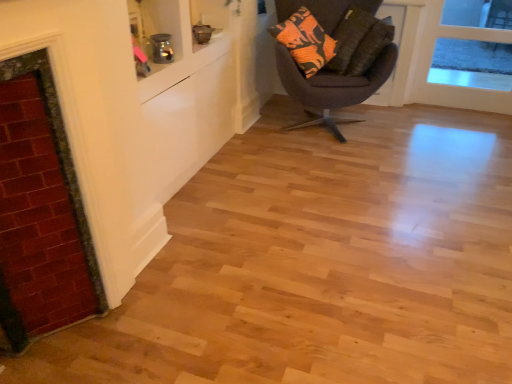
Describe the element at coordinates (349, 37) in the screenshot. I see `orange patterned pillow at upper right, the first pillow when ordered from back to front` at that location.

Describe the element at coordinates (332, 87) in the screenshot. The height and width of the screenshot is (384, 512). I see `dark brown fabric chair at center` at that location.

Identify the location of transparent glass door at upper right. The image size is (512, 384). (455, 86).

From the image's perspective, which is below, orange patterned pillow at upper right, the first pillow when ordered from back to front, or transparent glass door at upper right?

transparent glass door at upper right, from the image's perspective.

In terms of height, does orange patterned pillow at upper right, the first pillow when ordered from back to front, look taller or shorter compared to transparent glass door at upper right?

Clearly, orange patterned pillow at upper right, the first pillow when ordered from back to front, is shorter compared to transparent glass door at upper right.

At what (x,y) coordinates should I click in order to perform the action: click on door below the orange patterned pillow at upper right, which is counted as the second pillow, starting from the front (from a real-world perspective). Please return your answer as a coordinate pair (x, y). Image resolution: width=512 pixels, height=384 pixels. Looking at the image, I should click on (455, 86).

Which of these two, orange patterned pillow at upper right, which is counted as the second pillow, starting from the front, or transparent glass door at upper right, is wider?

orange patterned pillow at upper right, which is counted as the second pillow, starting from the front.

Is red brick fireplace at left facing away from dark brown fabric chair at center?

red brick fireplace at left does not have its back to dark brown fabric chair at center.

Between red brick fireplace at left and dark brown fabric chair at center, which one has more height?

With more height is red brick fireplace at left.

Is red brick fireplace at left at the right side of dark brown fabric chair at center?

No, red brick fireplace at left is not to the right of dark brown fabric chair at center.

From a real-world perspective, between transparent glass door at upper right and orange printed fabric pillow at upper right, marked as the 1th pillow in a front-to-back arrangement, who is vertically lower?

transparent glass door at upper right is physically lower.

Is transparent glass door at upper right spatially inside orange printed fabric pillow at upper right, acting as the second pillow starting from the back, or outside of it?

transparent glass door at upper right is not inside orange printed fabric pillow at upper right, acting as the second pillow starting from the back, it's outside.

How many degrees apart are the facing directions of transparent glass door at upper right and orange printed fabric pillow at upper right, acting as the second pillow starting from the back?

48 degrees.

Considering the relative sizes of transparent glass door at upper right and orange printed fabric pillow at upper right, marked as the 1th pillow in a front-to-back arrangement, in the image provided, is transparent glass door at upper right smaller than orange printed fabric pillow at upper right, marked as the 1th pillow in a front-to-back arrangement,?

Incorrect, transparent glass door at upper right is not smaller in size than orange printed fabric pillow at upper right, marked as the 1th pillow in a front-to-back arrangement.

From the image's perspective, is orange patterned pillow at upper right, which is counted as the second pillow, starting from the front, positioned above or below red brick fireplace at left?

Clearly, from the image's perspective, orange patterned pillow at upper right, which is counted as the second pillow, starting from the front, is above red brick fireplace at left.

Between orange patterned pillow at upper right, the first pillow when ordered from back to front, and red brick fireplace at left, which one has larger size?

orange patterned pillow at upper right, the first pillow when ordered from back to front, is bigger.

Is orange patterned pillow at upper right, which is counted as the second pillow, starting from the front, to the left of red brick fireplace at left from the viewer's perspective?

Incorrect, orange patterned pillow at upper right, which is counted as the second pillow, starting from the front, is not on the left side of red brick fireplace at left.

The height and width of the screenshot is (384, 512). I want to click on chair that appears behind the red brick fireplace at left, so 332,87.

Considering the relative positions of dark brown fabric chair at center and red brick fireplace at left in the image provided, is dark brown fabric chair at center behind red brick fireplace at left?

Yes, the depth of dark brown fabric chair at center is greater than that of red brick fireplace at left.

Which is more distant, (281, 59) or (76, 315)?

Positioned behind is point (281, 59).

Can you confirm if dark brown fabric chair at center is taller than red brick fireplace at left?

No, dark brown fabric chair at center is not taller than red brick fireplace at left.

Between point (362, 57) and point (417, 53), which one is positioned in front?

The point (362, 57) is closer.

Who is smaller, orange printed fabric pillow at upper right, acting as the second pillow starting from the back, or transparent glass door at upper right?

Smaller between the two is orange printed fabric pillow at upper right, acting as the second pillow starting from the back.

Looking at their sizes, would you say orange printed fabric pillow at upper right, acting as the second pillow starting from the back, is wider or thinner than transparent glass door at upper right?

orange printed fabric pillow at upper right, acting as the second pillow starting from the back, is wider than transparent glass door at upper right.

From a real-world perspective, is orange printed fabric pillow at upper right, marked as the 1th pillow in a front-to-back arrangement, over transparent glass door at upper right?

Correct, in the physical world, orange printed fabric pillow at upper right, marked as the 1th pillow in a front-to-back arrangement, is higher than transparent glass door at upper right.

Considering the sizes of objects orange printed fabric pillow at upper right, acting as the second pillow starting from the back, and dark brown fabric chair at center in the image provided, who is thinner, orange printed fabric pillow at upper right, acting as the second pillow starting from the back, or dark brown fabric chair at center?

orange printed fabric pillow at upper right, acting as the second pillow starting from the back.

How many degrees apart are the facing directions of orange printed fabric pillow at upper right, marked as the 1th pillow in a front-to-back arrangement, and dark brown fabric chair at center?

The angle between the facing direction of orange printed fabric pillow at upper right, marked as the 1th pillow in a front-to-back arrangement, and the facing direction of dark brown fabric chair at center is 31.7 degrees.

From a real-world perspective, which is physically above, orange printed fabric pillow at upper right, acting as the second pillow starting from the back, or dark brown fabric chair at center?

In real-world perspective, orange printed fabric pillow at upper right, acting as the second pillow starting from the back, is above.

Is orange printed fabric pillow at upper right, acting as the second pillow starting from the back, smaller than dark brown fabric chair at center?

Indeed, orange printed fabric pillow at upper right, acting as the second pillow starting from the back, has a smaller size compared to dark brown fabric chair at center.

From the transparent glass door at upper right, count 1st pillows forward and point to it. Please provide its 2D coordinates.

[(349, 37)]

The width and height of the screenshot is (512, 384). I want to click on chair on the right side of red brick fireplace at left, so click(332, 87).

Which object lies further to the anchor point transparent glass door at upper right, red brick fireplace at left or orange patterned pillow at upper right, which is counted as the second pillow, starting from the front?

The object further to transparent glass door at upper right is red brick fireplace at left.

Which object lies nearer to the anchor point red brick fireplace at left, orange printed fabric pillow at upper right, acting as the second pillow starting from the back, or dark brown fabric chair at center?

dark brown fabric chair at center is positioned closer to the anchor red brick fireplace at left.

Estimate the real-world distances between objects in this image. Which object is further from dark brown fabric chair at center, orange patterned pillow at upper right, which is counted as the second pillow, starting from the front, or transparent glass door at upper right?

transparent glass door at upper right is further to dark brown fabric chair at center.

When comparing their distances from red brick fireplace at left, does orange patterned pillow at upper right, the first pillow when ordered from back to front, or dark brown fabric chair at center seem further?

The object further to red brick fireplace at left is orange patterned pillow at upper right, the first pillow when ordered from back to front.

Estimate the real-world distances between objects in this image. Which object is further from orange printed fabric pillow at upper right, marked as the 1th pillow in a front-to-back arrangement, orange patterned pillow at upper right, which is counted as the second pillow, starting from the front, or dark brown fabric chair at center?

dark brown fabric chair at center is positioned further to the anchor orange printed fabric pillow at upper right, marked as the 1th pillow in a front-to-back arrangement.

When comparing their distances from orange patterned pillow at upper right, the first pillow when ordered from back to front, does orange printed fabric pillow at upper right, acting as the second pillow starting from the back, or red brick fireplace at left seem further?

red brick fireplace at left is positioned further to the anchor orange patterned pillow at upper right, the first pillow when ordered from back to front.

Based on the photo, estimate the real-world distances between objects in this image. Which object is closer to orange patterned pillow at upper right, the first pillow when ordered from back to front, transparent glass door at upper right or orange printed fabric pillow at upper right, marked as the 1th pillow in a front-to-back arrangement?

orange printed fabric pillow at upper right, marked as the 1th pillow in a front-to-back arrangement, lies closer to orange patterned pillow at upper right, the first pillow when ordered from back to front, than the other object.

Consider the image. Considering their positions, is orange printed fabric pillow at upper right, acting as the second pillow starting from the back, positioned closer to red brick fireplace at left than orange patterned pillow at upper right, which is counted as the second pillow, starting from the front?

orange printed fabric pillow at upper right, acting as the second pillow starting from the back, lies closer to red brick fireplace at left than the other object.

Where is `pillow between dark brown fabric chair at center and orange patterned pillow at upper right, which is counted as the second pillow, starting from the front, along the z-axis`? The width and height of the screenshot is (512, 384). pillow between dark brown fabric chair at center and orange patterned pillow at upper right, which is counted as the second pillow, starting from the front, along the z-axis is located at coordinates tap(370, 47).

Where is `chair between red brick fireplace at left and transparent glass door at upper right from left to right`? chair between red brick fireplace at left and transparent glass door at upper right from left to right is located at coordinates (332, 87).

Where is `chair between red brick fireplace at left and orange printed fabric pillow at upper right, marked as the 1th pillow in a front-to-back arrangement, in the front-back direction`? chair between red brick fireplace at left and orange printed fabric pillow at upper right, marked as the 1th pillow in a front-to-back arrangement, in the front-back direction is located at coordinates (332, 87).

At what (x,y) coordinates should I click in order to perform the action: click on pillow located between orange patterned pillow at upper right, the first pillow when ordered from back to front, and transparent glass door at upper right in the left-right direction. Please return your answer as a coordinate pair (x, y). The width and height of the screenshot is (512, 384). Looking at the image, I should click on (370, 47).